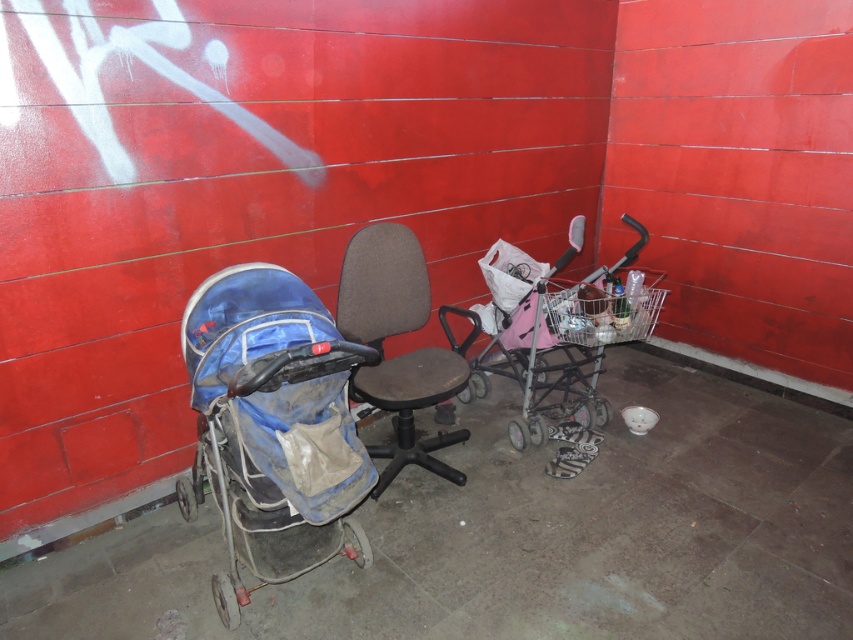
You are standing in the corner of a room with red walls and a concrete floor. You see a baby stroller with a blue canopy and a gray base and a dark gray fabric office chair at center. Which object is located at the point marked by coordinates point (381,284)?

The dark gray fabric office chair at center is located at point (381,284).

You are a delivery person who needs to move a large package through the space between the blue fabric stroller at left and the dark gray fabric office chair at center. The package is 24 inches wide. Can you fit the package between them without moving either object?

The blue fabric stroller at left is 22.05 inches away from the dark gray fabric office chair at center. Since the package is 24 inches wide, which is wider than the 22.05 inch gap, the package cannot fit between them without moving either object.